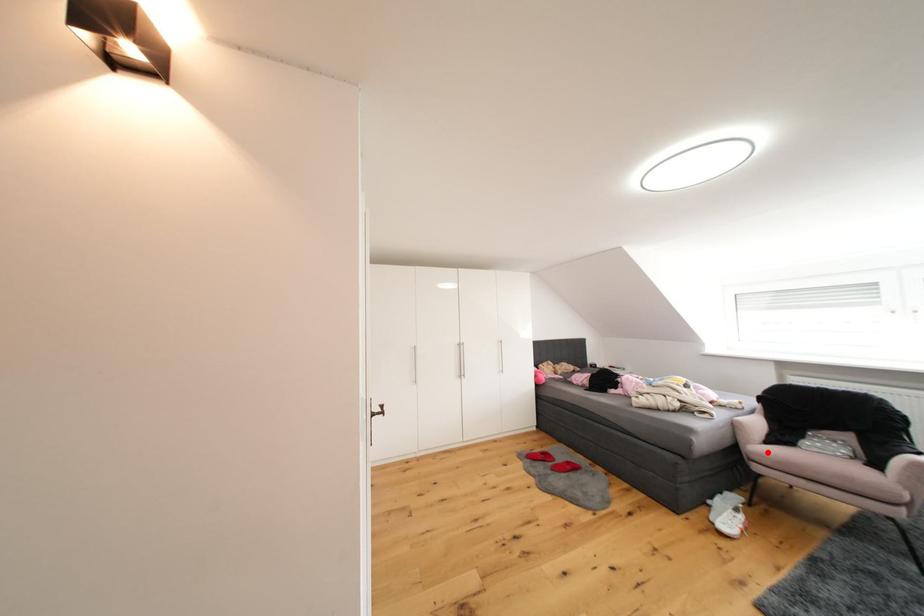
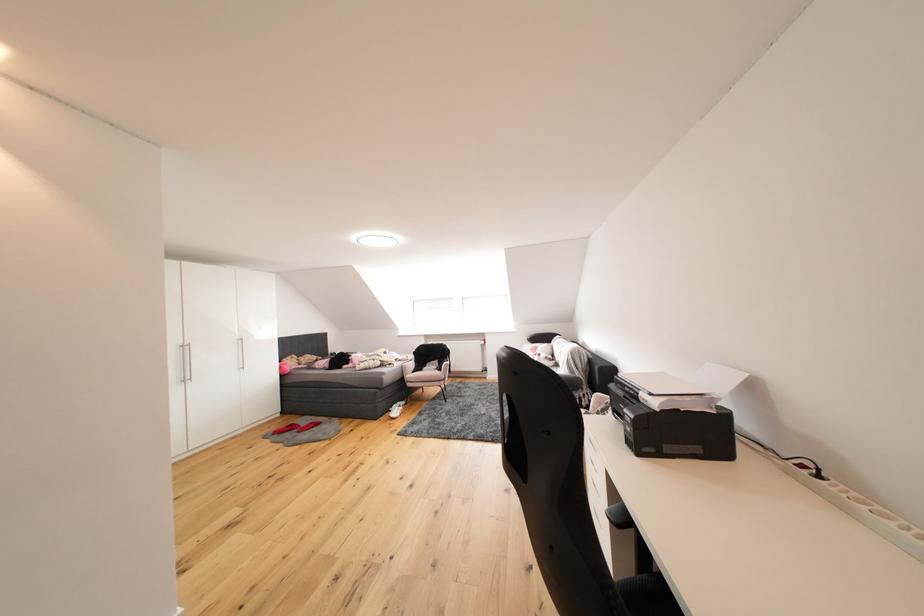
Question: I am providing you with two images of the same scene from different viewpoints. In image1, a red point is highlighted. Considering the same 3D point in image2, which of the following is correct?

Choices:
 (A) It is closer
 (B) It is farther

Answer: (B)